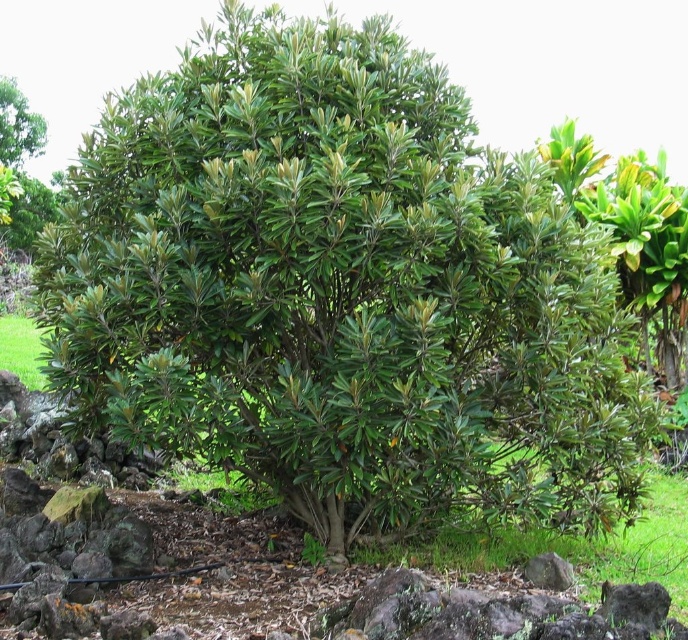
Question: Is green leafy bush at upper left below gray rough stone at lower center?

Choices:
 (A) no
 (B) yes

Answer: (A)

Question: Can you confirm if green leafy bush at upper left is positioned to the right of gray rock at lower right?

Choices:
 (A) no
 (B) yes

Answer: (A)

Question: Estimate the real-world distances between objects in this image. Which object is farther from the gray rock at lower right?

Choices:
 (A) green leafy bush at upper left
 (B) gray rough stone at lower center

Answer: (A)

Question: Which object is farther from the camera taking this photo?

Choices:
 (A) gray rough stone at lower center
 (B) green leafy bush at upper left
 (C) gray rock at lower right

Answer: (B)

Question: Which point is closer to the camera?

Choices:
 (A) (23, 154)
 (B) (533, 563)

Answer: (B)

Question: Is gray rock at lower right to the right of gray rough stone at lower center from the viewer's perspective?

Choices:
 (A) no
 (B) yes

Answer: (B)